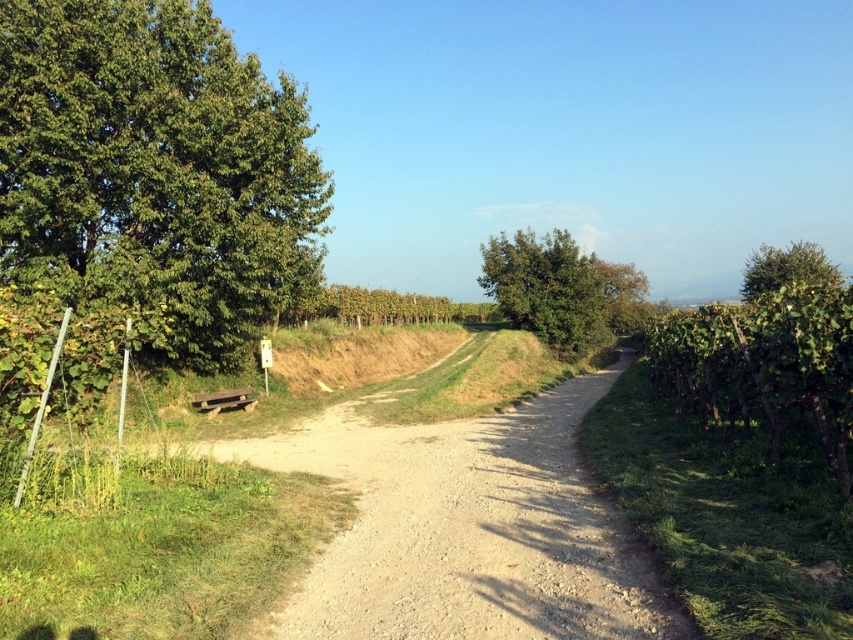
Question: Is green leafy tree at left above dusty gravel path at center?

Choices:
 (A) yes
 (B) no

Answer: (A)

Question: Which point is farther to the camera?

Choices:
 (A) green leafy tree at left
 (B) dusty gravel path at center

Answer: (A)

Question: Is green leafy tree at left bigger than green leafy tree at right?

Choices:
 (A) no
 (B) yes

Answer: (A)

Question: Which object is the farthest from the green leafy tree at center?

Choices:
 (A) green leafy tree at left
 (B) dusty gravel path at center

Answer: (B)

Question: Can you confirm if green leafy tree at left is thinner than green leafy tree at right?

Choices:
 (A) no
 (B) yes

Answer: (B)

Question: Which of the following is the farthest from the observer?

Choices:
 (A) green leafy tree at left
 (B) green leafy tree at right
 (C) green leafy tree at center
 (D) dusty gravel path at center

Answer: (C)